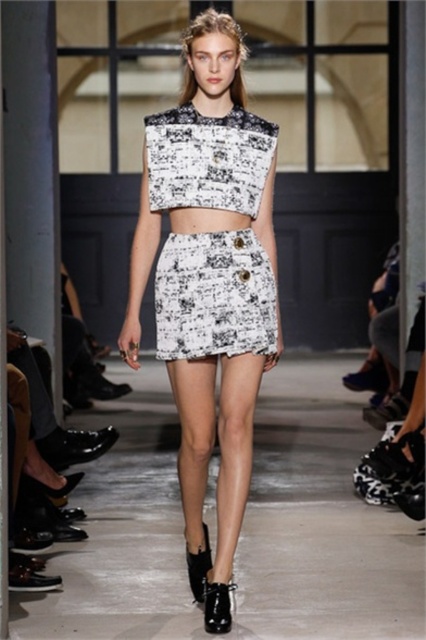
Looking at this image, you are a photographer at the runway show and need to focus on the white printed fabric skirt at center and the white printed fabric dress at center. Which one is positioned lower in the image?

The white printed fabric skirt at center is positioned below the white printed fabric dress at center, so it is lower in the image.

You are a photographer at the runway show and need to capture the model wearing both the white printed fabric skirt at center and the white printed fabric dress at center. Since you want to highlight their height differences, which one should you focus on more?

The white printed fabric skirt at center is much taller than the white printed fabric dress at center, so you should focus more on the white printed fabric skirt at center to emphasize its greater height.